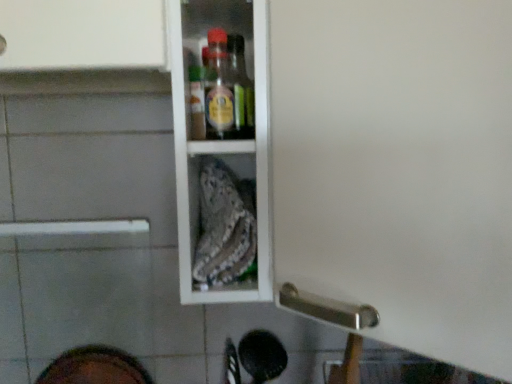
Question: Does white glossy cabinet at upper center have a greater height compared to dark brown leather shoe at lower left?

Choices:
 (A) yes
 (B) no

Answer: (A)

Question: Is dark brown leather shoe at lower left completely or partially inside white glossy cabinet at upper center?

Choices:
 (A) no
 (B) yes

Answer: (A)

Question: Is white glossy cabinet at upper center thinner than dark brown leather shoe at lower left?

Choices:
 (A) no
 (B) yes

Answer: (A)

Question: Can you confirm if white glossy cabinet at upper center is smaller than dark brown leather shoe at lower left?

Choices:
 (A) no
 (B) yes

Answer: (A)

Question: Is the surface of white glossy cabinet at upper center in direct contact with dark brown leather shoe at lower left?

Choices:
 (A) no
 (B) yes

Answer: (A)

Question: Could you tell me if white glossy cabinet at upper center is turned towards dark brown leather shoe at lower left?

Choices:
 (A) no
 (B) yes

Answer: (A)

Question: Considering the relative positions of dark brown leather shoe at lower left and white glossy cabinet at upper center in the image provided, is dark brown leather shoe at lower left to the right of white glossy cabinet at upper center from the viewer's perspective?

Choices:
 (A) no
 (B) yes

Answer: (A)

Question: Would you say white glossy cabinet at upper center is part of dark brown leather shoe at lower left's contents?

Choices:
 (A) yes
 (B) no

Answer: (B)

Question: Is dark brown leather shoe at lower left smaller than white glossy cabinet at upper center?

Choices:
 (A) no
 (B) yes

Answer: (B)

Question: Is dark brown leather shoe at lower left looking in the opposite direction of white glossy cabinet at upper center?

Choices:
 (A) yes
 (B) no

Answer: (B)

Question: From a real-world perspective, is dark brown leather shoe at lower left positioned under white glossy cabinet at upper center based on gravity?

Choices:
 (A) yes
 (B) no

Answer: (A)

Question: Is dark brown leather shoe at lower left taller than white glossy cabinet at upper center?

Choices:
 (A) yes
 (B) no

Answer: (B)

Question: Considering the positions of dark brown leather shoe at lower left and white glossy cabinet at upper center in the image, is dark brown leather shoe at lower left wider or thinner than white glossy cabinet at upper center?

Choices:
 (A) wide
 (B) thin

Answer: (B)